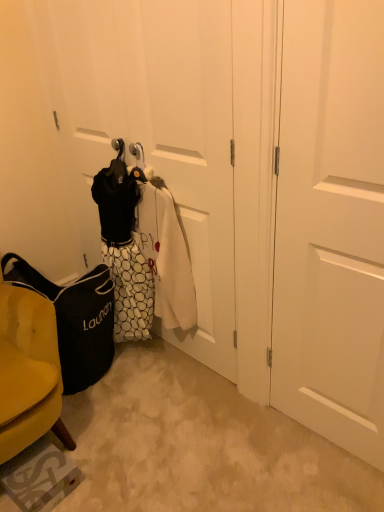
Question: From a real-world perspective, does black fabric laundry bag at lower left sit lower than white dotted fabric laundry at center?

Choices:
 (A) no
 (B) yes

Answer: (B)

Question: Can you confirm if black fabric laundry bag at lower left is positioned to the right of white dotted fabric laundry at center?

Choices:
 (A) no
 (B) yes

Answer: (A)

Question: Could you tell me if black fabric laundry bag at lower left is facing white dotted fabric laundry at center?

Choices:
 (A) no
 (B) yes

Answer: (A)

Question: Are black fabric laundry bag at lower left and white dotted fabric laundry at center making contact?

Choices:
 (A) yes
 (B) no

Answer: (B)

Question: Is black fabric laundry bag at lower left at the left side of white dotted fabric laundry at center?

Choices:
 (A) yes
 (B) no

Answer: (A)

Question: Is white dotted fabric laundry at center to the left or to the right of black fabric laundry bag at lower left in the image?

Choices:
 (A) left
 (B) right

Answer: (B)

Question: From a real-world perspective, is white dotted fabric laundry at center above or below black fabric laundry bag at lower left?

Choices:
 (A) above
 (B) below

Answer: (A)

Question: Is white dotted fabric laundry at center situated inside black fabric laundry bag at lower left or outside?

Choices:
 (A) inside
 (B) outside

Answer: (B)

Question: Is white dotted fabric laundry at center bigger or smaller than black fabric laundry bag at lower left?

Choices:
 (A) big
 (B) small

Answer: (B)

Question: Looking at the image, does white dotted fabric laundry at center seem bigger or smaller compared to white matte door at center right?

Choices:
 (A) small
 (B) big

Answer: (B)

Question: Considering the positions of white dotted fabric laundry at center and white matte door at center right in the image, is white dotted fabric laundry at center taller or shorter than white matte door at center right?

Choices:
 (A) short
 (B) tall

Answer: (A)

Question: From the image's perspective, relative to white matte door at center right, is white dotted fabric laundry at center above or below?

Choices:
 (A) above
 (B) below

Answer: (A)

Question: Do you think white dotted fabric laundry at center is within white matte door at center right, or outside of it?

Choices:
 (A) inside
 (B) outside

Answer: (B)

Question: Looking at their shapes, would you say black fabric laundry bag at lower left is wider or thinner than white dotted fabric laundry at center?

Choices:
 (A) wide
 (B) thin

Answer: (A)

Question: Is black fabric laundry bag at lower left taller or shorter than white dotted fabric laundry at center?

Choices:
 (A) tall
 (B) short

Answer: (B)